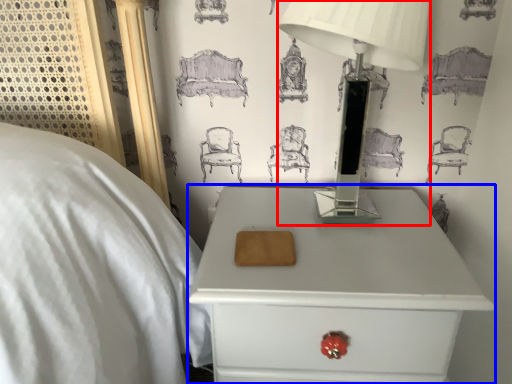
Question: Among these objects, which one is farthest to the camera, table lamp (highlighted by a red box) or nightstand (highlighted by a blue box)?

Choices:
 (A) table lamp
 (B) nightstand

Answer: (B)